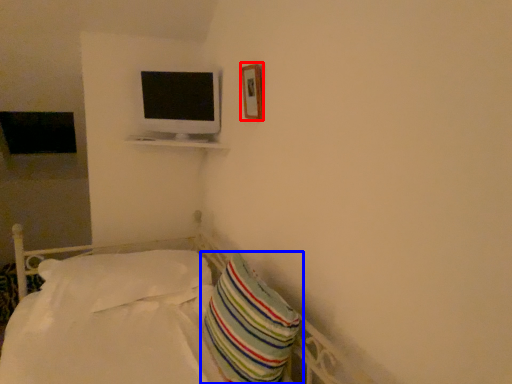
Question: Which object is closer to the camera taking this photo, picture frame (highlighted by a red box) or pillow (highlighted by a blue box)?

Choices:
 (A) picture frame
 (B) pillow

Answer: (B)